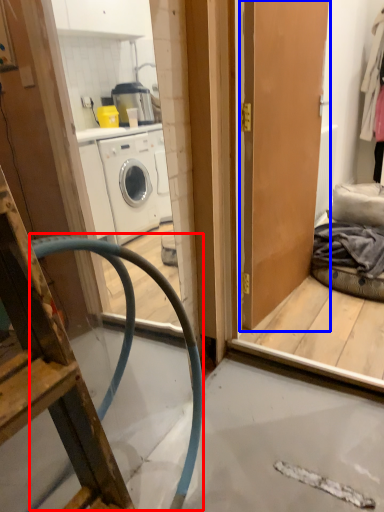
Question: Which object appears farthest to the camera in this image, garden hose (highlighted by a red box) or door (highlighted by a blue box)?

Choices:
 (A) garden hose
 (B) door

Answer: (B)